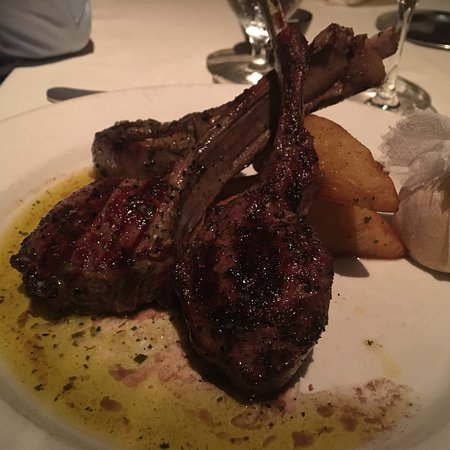
This screenshot has width=450, height=450. Find the location of `metal bowl small`. metal bowl small is located at coordinates (304, 24).